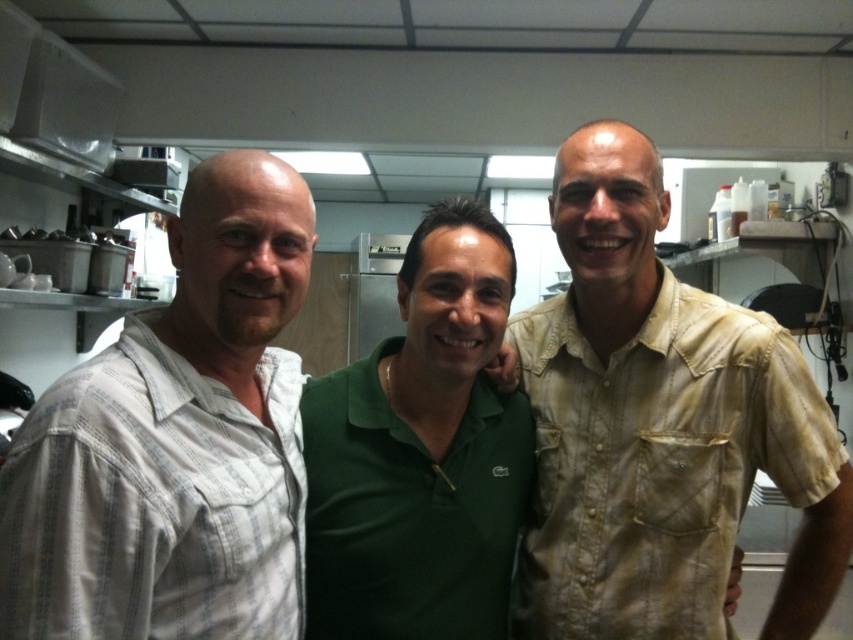
Can you confirm if light brown textured shirt at right is bigger than green polo shirt at center?

Yes.

Does point (570, 250) come behind point (463, 449)?

No, (570, 250) is in front of (463, 449).

Find the location of a particular element. light brown textured shirt at right is located at coordinates (659, 426).

Does light beige striped shirt at left have a greater height compared to green polo shirt at center?

Incorrect, light beige striped shirt at left's height is not larger of green polo shirt at center's.

Measure the distance between light beige striped shirt at left and camera.

They are 29.78 inches apart.

Who is more distant from viewer, (51,385) or (436,524)?

The point (436,524) is more distant.

This screenshot has height=640, width=853. I want to click on light beige striped shirt at left, so click(175, 442).

Can you confirm if light brown textured shirt at right is positioned to the left of light beige striped shirt at left?

Incorrect, light brown textured shirt at right is not on the left side of light beige striped shirt at left.

Looking at this image, between light brown textured shirt at right and light beige striped shirt at left, which one is positioned higher?

light beige striped shirt at left is above.

Measure the distance between light brown textured shirt at right and camera.

A distance of 3.75 feet exists between light brown textured shirt at right and camera.

The height and width of the screenshot is (640, 853). Identify the location of light brown textured shirt at right. (659, 426).